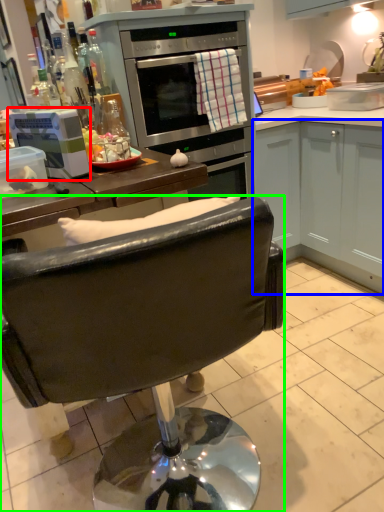
Question: Estimate the real-world distances between objects in this image. Which object is closer to kitchen appliance (highlighted by a red box), cabinetry (highlighted by a blue box) or chair (highlighted by a green box)?

Choices:
 (A) cabinetry
 (B) chair

Answer: (B)